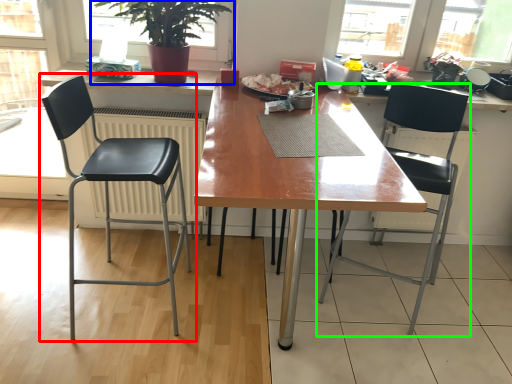
Question: Estimate the real-world distances between objects in this image. Which object is farther from chair (highlighted by a red box), houseplant (highlighted by a blue box) or chair (highlighted by a green box)?

Choices:
 (A) houseplant
 (B) chair

Answer: (B)